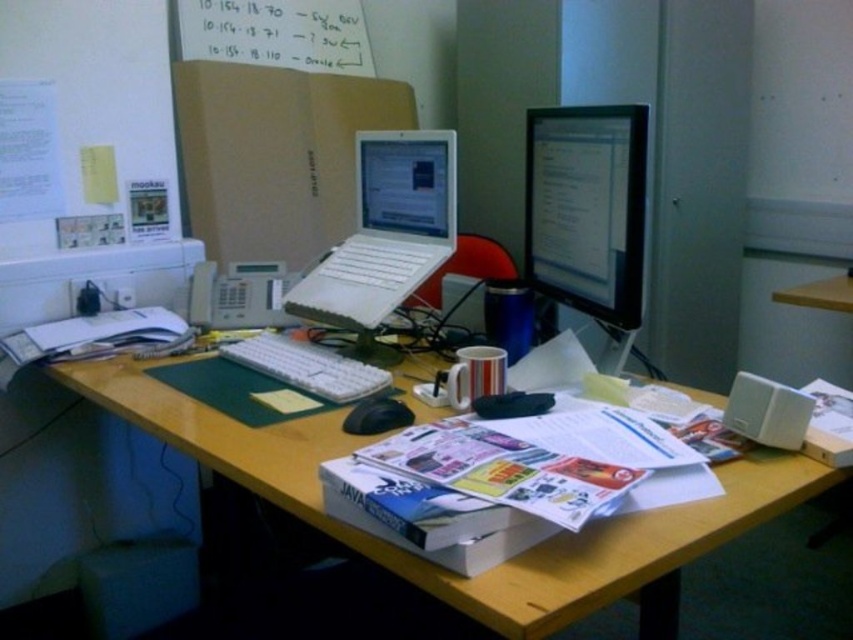
Question: Is black glossy monitor at center closer to camera compared to white plastic keyboard at center?

Choices:
 (A) yes
 (B) no

Answer: (A)

Question: Which of the following is the closest to the observer?

Choices:
 (A) (323, 371)
 (B) (434, 150)
 (C) (643, 556)

Answer: (C)

Question: Based on their relative distances, which object is nearer to the white plastic keyboard at center?

Choices:
 (A) white paperboard at upper center
 (B) black glossy monitor at center
 (C) white plastic laptop at center

Answer: (C)

Question: Does white plastic laptop at center have a larger size compared to white paperboard at upper center?

Choices:
 (A) yes
 (B) no

Answer: (B)

Question: Can you confirm if wooden at center is positioned below white plastic printer at center?

Choices:
 (A) no
 (B) yes

Answer: (B)

Question: Estimate the real-world distances between objects in this image. Which object is farther from the white paperboard at upper center?

Choices:
 (A) wooden at center
 (B) white plastic printer at center

Answer: (A)